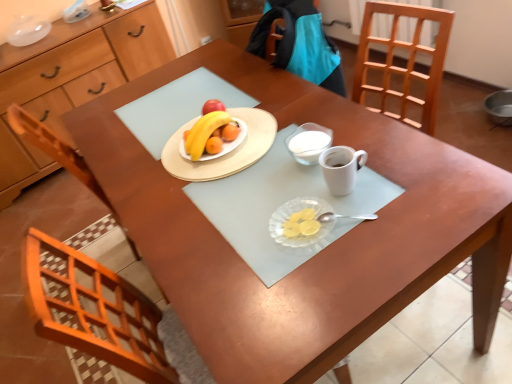
At what (x,y) coordinates should I click in order to perform the action: click on vacant area to the right of transparent glass plate at center. Please return your answer as a coordinate pair (x, y). This screenshot has width=512, height=384. Looking at the image, I should click on (377, 210).